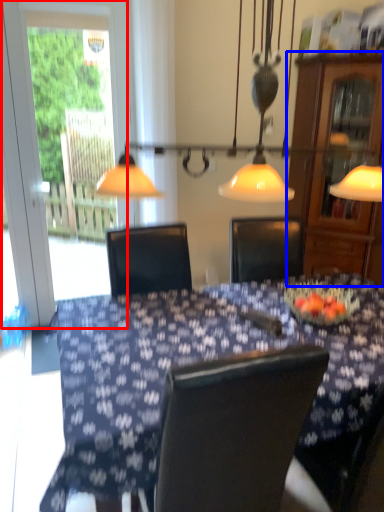
Question: Which point is further to the camera, screen door (highlighted by a red box) or cabinetry (highlighted by a blue box)?

Choices:
 (A) screen door
 (B) cabinetry

Answer: (A)